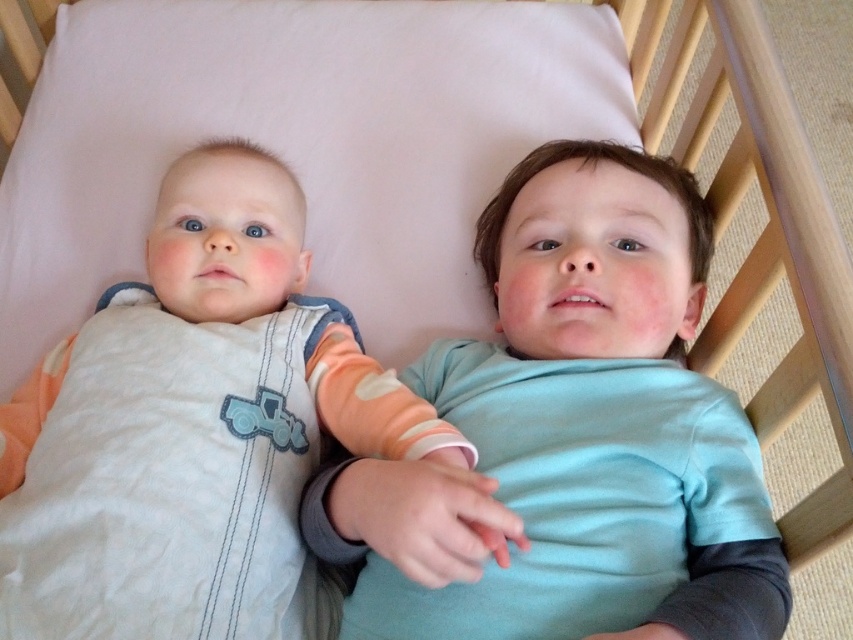
You are standing 24 inches away from the crib. You see a point at coordinates point (451, 563). Is the point closer to you than the crib?

The point (451, 563) is 22.59 inches away from the viewer, which is less than 24 inches. Therefore, the point is closer to you than the crib.

You are a photographer taking a picture of two children in a crib. You notice the matte blue shirt at center and the white cotton onesie at center. Which clothing item is positioned higher in the image?

The matte blue shirt at center is located above the white cotton onesie at center, so it is positioned higher in the image.

You are a photographer trying to capture a closeup of both the matte blue shirt at center and the white cotton onesie at center in the image. The camera you are using has a maximum focus range of 7 inches. Can you focus on both items simultaneously without moving the camera?

The matte blue shirt at center is 7.44 inches from the white cotton onesie at center. Since the distance between them exceeds the camera maximum focus range of 7 inches, you cannot focus on both items simultaneously without moving the camera.